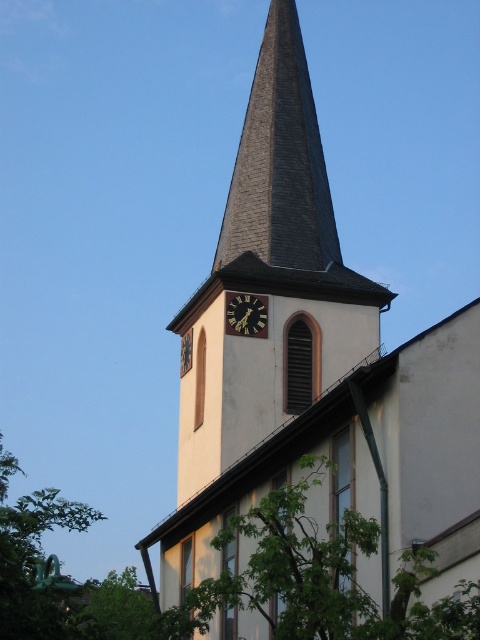
You are standing in front of the church and notice a point marked at coordinates [313,365]. Based on the scene description, what object does this point correspond to?

The point at coordinates [313,365] corresponds to the white smooth steeple at center.

You are standing in front of the church and want to take a photo that includes both the white smooth steeple at center and the green leafy tree at lower center. Based on their sizes, which object should you focus on first to ensure both are in frame?

The white smooth steeple at center might be wider than green leafy tree at lower center, so you should focus on the white smooth steeple at center first to ensure both fit in the frame.

You are standing in front of the church and want to know which object is taller between the white smooth steeple at center and the gold metallic clock at center. Can you determine which one is taller?

The white smooth steeple at center is taller than the gold metallic clock at center according to the description.